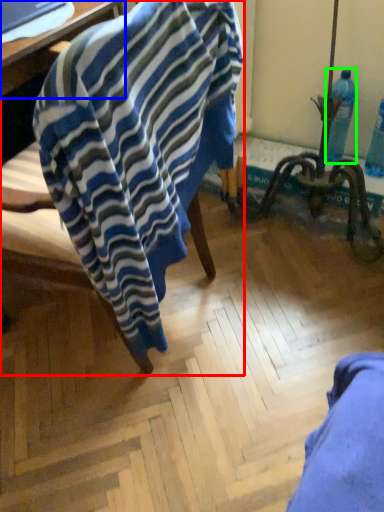
Question: Which object is the closest to the chair (highlighted by a red box)? Choose among these: table (highlighted by a blue box) or bottle (highlighted by a green box).

Choices:
 (A) table
 (B) bottle

Answer: (A)